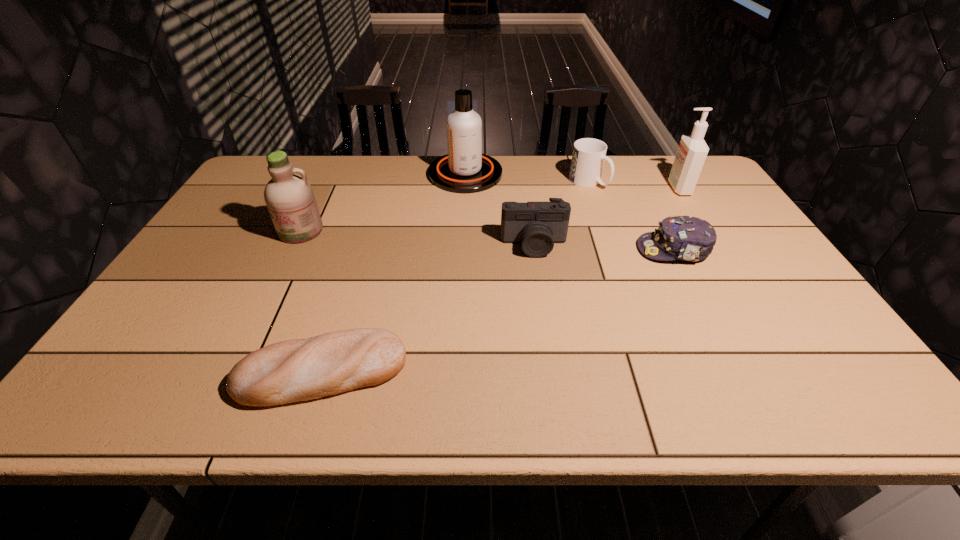
This screenshot has width=960, height=540. Identify the location of the second cleansing agent from right to left. point(464,169).

Where is `the rightmost cleansing agent`? the rightmost cleansing agent is located at coordinates (692, 151).

You are a GUI agent. You are given a task and a screenshot of the screen. Output one action in this format:
    pyautogui.click(x=<x>, y=<y>)
    Task: Click on the leftmost cleansing agent
    This screenshot has width=960, height=540.
    Given the screenshot: What is the action you would take?
    pyautogui.click(x=290, y=200)

Locate an element on the screen. the third object from right to left is located at coordinates (589, 154).

At what (x,y) coordinates should I click in order to perform the action: click on camera. Please return your answer as a coordinate pair (x, y). The image size is (960, 540). Looking at the image, I should click on (537, 225).

Identify the location of headwear. (687, 238).

The height and width of the screenshot is (540, 960). In order to click on bread in this screenshot , I will do `click(295, 370)`.

At what (x,y) coordinates should I click in order to perform the action: click on free space located 0.300m on the right of the second cleansing agent from right to left. Please return your answer as a coordinate pair (x, y). The height and width of the screenshot is (540, 960). Looking at the image, I should click on (590, 174).

In order to click on free space located on the front label of the rightmost cleansing agent in this screenshot , I will do `click(629, 188)`.

What are the coordinates of `vacant area located on the front label of the rightmost cleansing agent` in the screenshot? It's located at (604, 188).